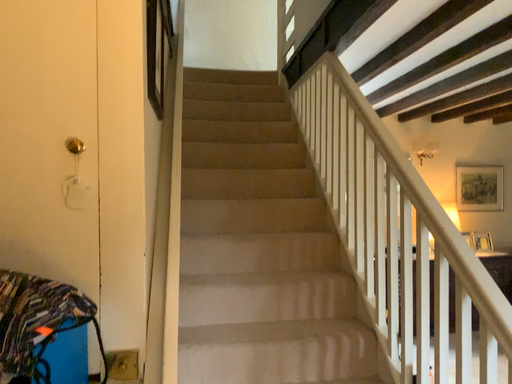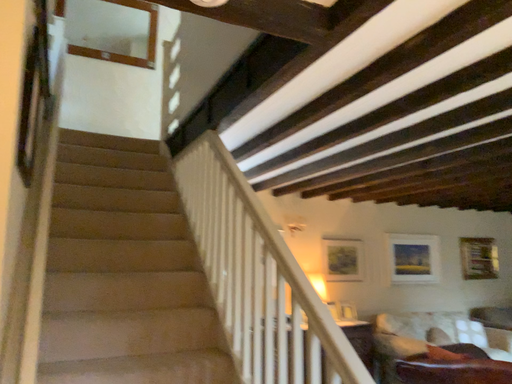
Question: How did the camera likely rotate when shooting the video?

Choices:
 (A) rotated right
 (B) rotated left

Answer: (A)